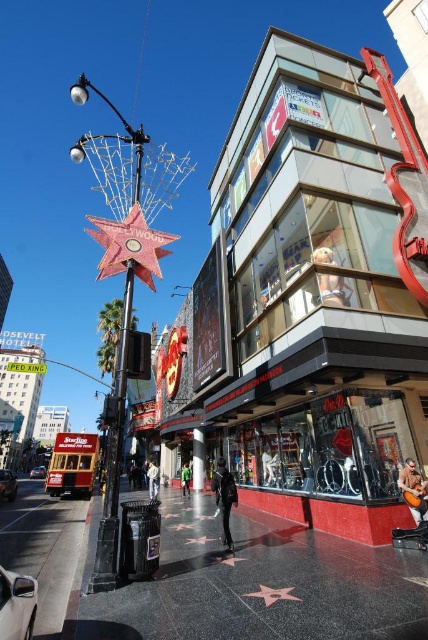
You are a delivery person who needs to place a large package on the ground. You have two options from the image, the concrete sidewalk at center and the smooth asphalt pavement at lower left. Which surface has more space to accommodate the package?

The smooth asphalt pavement at lower left has more space because it is larger than the concrete sidewalk at center.

You are a tourist standing at the edge of the street in Hollywood. You see the concrete sidewalk at center and the pink polished star at center. Which object is closer to your right side?

The pink polished star at center is closer to your right side because the concrete sidewalk at center is positioned on its left side.